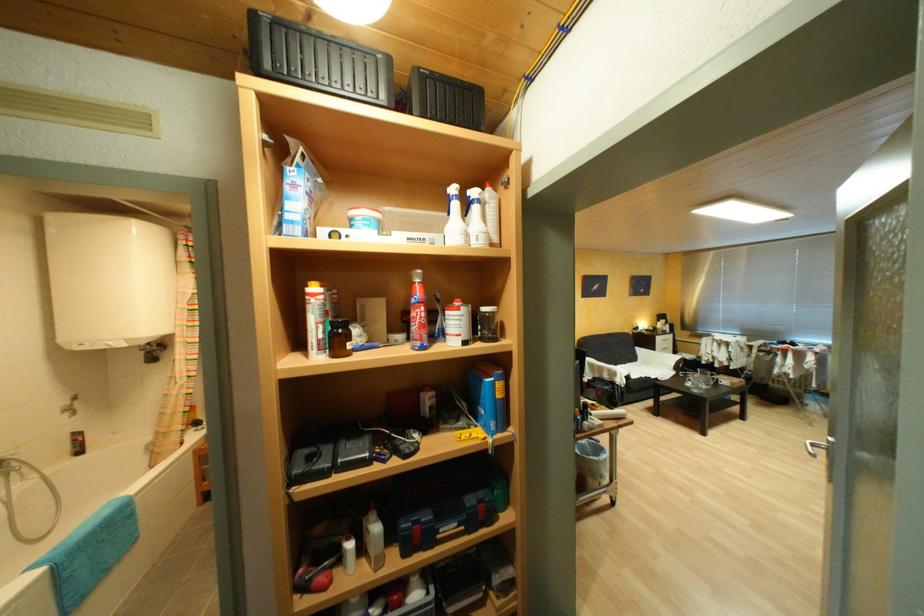
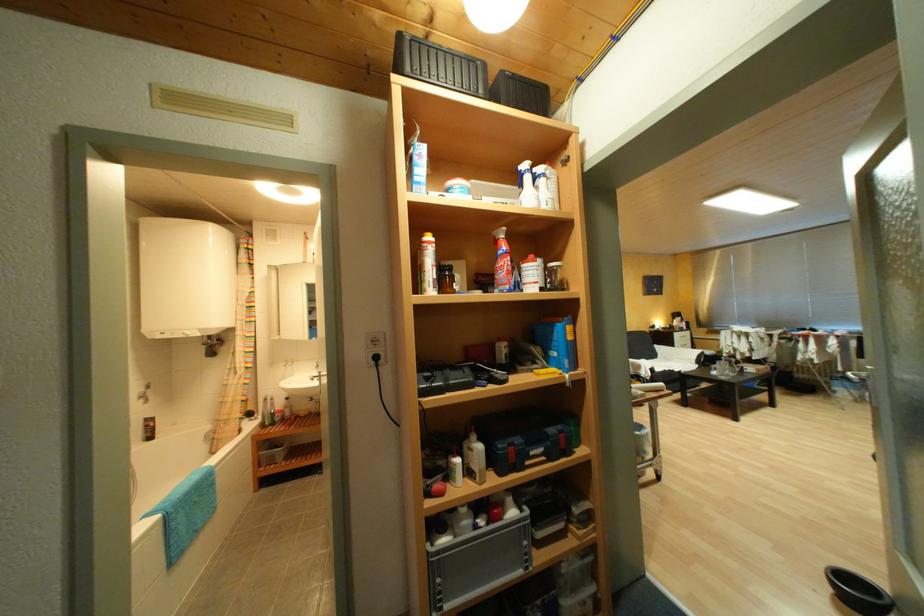
Where in the second image is the point corresponding to (330,320) from the first image?

(444, 264)